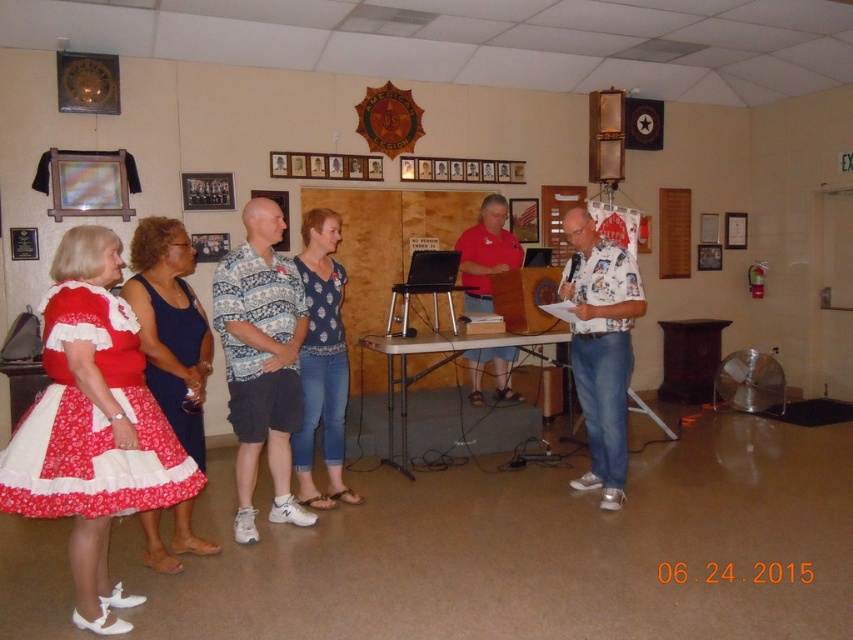
Does point (242, 435) come in front of point (485, 252)?

Yes, point (242, 435) is closer to viewer.

Does patterned fabric shirt at center have a lesser width compared to matte pink shirt at center?

Yes, patterned fabric shirt at center is thinner than matte pink shirt at center.

Is point (279, 300) closer to camera compared to point (486, 266)?

Yes.

I want to click on patterned fabric shirt at center, so click(x=260, y=360).

Can you confirm if red floral fabric dress at lower left is positioned above blue satin dress at left?

Yes.

Who is positioned more to the right, red floral fabric dress at lower left or blue satin dress at left?

blue satin dress at left is more to the right.

I want to click on red floral fabric dress at lower left, so click(x=91, y=422).

The height and width of the screenshot is (640, 853). In order to click on red floral fabric dress at lower left in this screenshot , I will do `click(91, 422)`.

In the scene shown: Is red floral fabric dress at lower left to the left of blue printed blouse at center from the viewer's perspective?

Yes, red floral fabric dress at lower left is to the left of blue printed blouse at center.

Is red floral fabric dress at lower left wider than blue printed blouse at center?

Indeed, red floral fabric dress at lower left has a greater width compared to blue printed blouse at center.

Where is `red floral fabric dress at lower left`? This screenshot has width=853, height=640. red floral fabric dress at lower left is located at coordinates (91, 422).